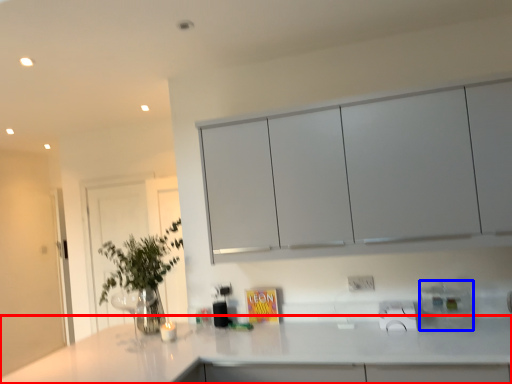
Question: Which object is closer to the camera taking this photo, countertop (highlighted by a red box) or appliance (highlighted by a blue box)?

Choices:
 (A) countertop
 (B) appliance

Answer: (A)